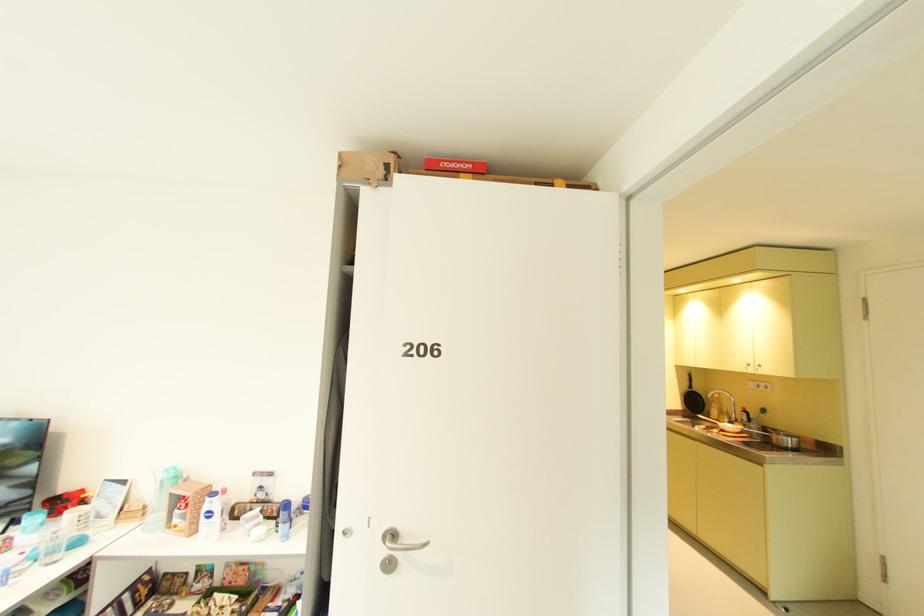
Describe the element at coordinates (747, 513) in the screenshot. I see `a cabinet handle` at that location.